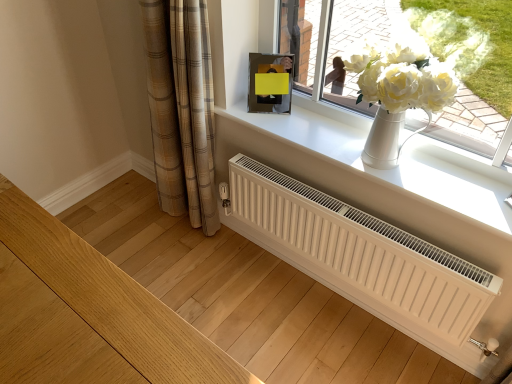
The image size is (512, 384). Identify the location of free region under plaid fabric curtain at lower left (from a real-world perspective). (188, 227).